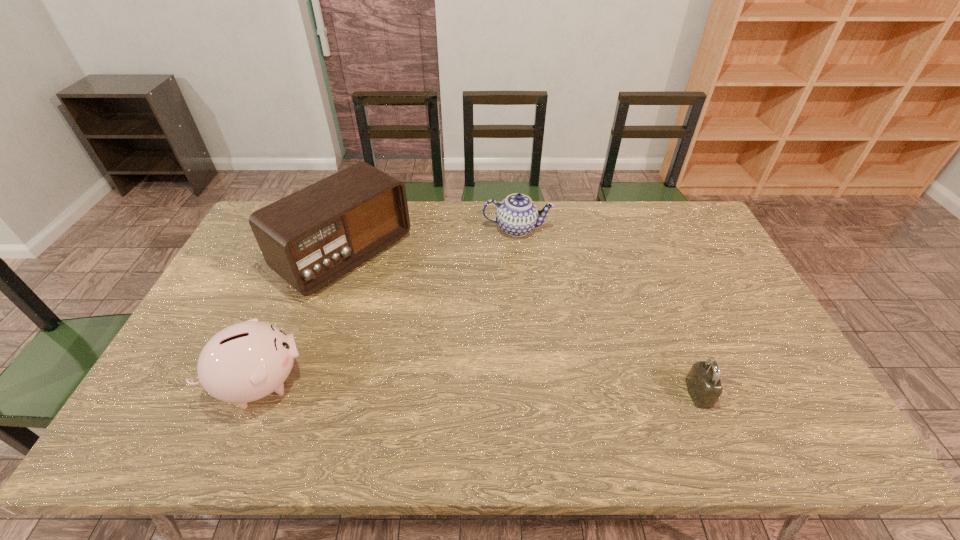
Where is `vacant spot on the desktop that is between the third shortest object and the padlock and is positioned on the front-facing side of the radio receiver`? This screenshot has height=540, width=960. vacant spot on the desktop that is between the third shortest object and the padlock and is positioned on the front-facing side of the radio receiver is located at coordinates (535, 389).

Identify the location of vacant spot on the desktop that is between the second tallest object and the shortest object and is positioned at the spout of the chinaware. The height and width of the screenshot is (540, 960). (496, 388).